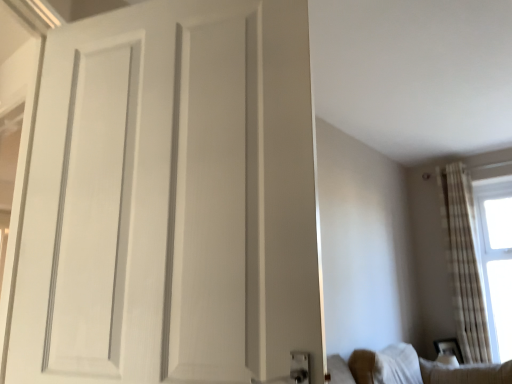
Locate an element on the screen. The width and height of the screenshot is (512, 384). white matte door at center is located at coordinates (173, 199).

This screenshot has height=384, width=512. Describe the element at coordinates (496, 258) in the screenshot. I see `white sheer curtain at right` at that location.

The image size is (512, 384). Describe the element at coordinates (464, 262) in the screenshot. I see `white sheer curtains at right` at that location.

Describe the element at coordinates (414, 370) in the screenshot. This screenshot has height=384, width=512. I see `white fabric couch at lower right` at that location.

Image resolution: width=512 pixels, height=384 pixels. Identify the location of white matte door at center. (173, 199).

Would you say white sheer curtains at right is outside white matte door at center?

That's correct, white sheer curtains at right is outside of white matte door at center.

Is white sheer curtains at right to the left of white matte door at center from the viewer's perspective?

No, white sheer curtains at right is not to the left of white matte door at center.

Considering the sizes of objects white sheer curtains at right and white matte door at center in the image provided, who is smaller, white sheer curtains at right or white matte door at center?

white matte door at center is smaller.

This screenshot has height=384, width=512. I want to click on window behind the white matte door at center, so click(x=464, y=262).

Between point (376, 356) and point (504, 330), which one is positioned behind?

The point (504, 330) is behind.

Does white fabric couch at lower right have a smaller size compared to white sheer curtain at right?

Yes.

Is white fabric couch at lower right not close to white sheer curtain at right?

Absolutely, white fabric couch at lower right is distant from white sheer curtain at right.

Could you tell me if white fabric couch at lower right is turned towards white sheer curtain at right?

No.

In terms of width, does white sheer curtain at right look wider or thinner when compared to white fabric couch at lower right?

In the image, white sheer curtain at right appears to be more narrow than white fabric couch at lower right.

From a real-world perspective, is white sheer curtain at right positioned above or below white fabric couch at lower right?

white sheer curtain at right is situated higher than white fabric couch at lower right in the real world.

Looking at this image, which point is more distant from viewer, (488, 285) or (417, 362)?

Positioned behind is point (488, 285).

Is white sheer curtain at right bigger or smaller than white fabric couch at lower right?

Clearly, white sheer curtain at right is larger in size than white fabric couch at lower right.

Image resolution: width=512 pixels, height=384 pixels. What are the coordinates of `window screen on the right of white sheer curtains at right` in the screenshot? It's located at (496, 258).

Which is in front, white sheer curtain at right or white sheer curtains at right?

Positioned in front is white sheer curtains at right.

From the image's perspective, does white sheer curtain at right appear higher than white sheer curtains at right?

No, from the image's perspective, white sheer curtain at right is not on top of white sheer curtains at right.

In the scene shown: Is white sheer curtains at right positioned far away from white fabric couch at lower right?

Indeed, white sheer curtains at right is not near white fabric couch at lower right.

Locate an element on the screen. Image resolution: width=512 pixels, height=384 pixels. window lying behind the white fabric couch at lower right is located at coordinates [464, 262].

From a real-world perspective, which object rests below the other?

white fabric couch at lower right, from a real-world perspective.

Between white sheer curtains at right and white fabric couch at lower right, which one has smaller width?

white fabric couch at lower right.

Which is behind, point (58, 372) or point (481, 361)?

The point (481, 361) is farther.

Based on their sizes in the image, would you say white matte door at center is bigger or smaller than white sheer curtains at right?

In the image, white matte door at center appears to be smaller than white sheer curtains at right.

Based on the photo, from the image's perspective, is white matte door at center over white sheer curtains at right?

Yes, from the image's perspective, white matte door at center is over white sheer curtains at right.

Who is more distant, white fabric couch at lower right or white sheer curtains at right?

white sheer curtains at right is behind.

Consider the image. Can you tell me how much white fabric couch at lower right and white sheer curtains at right differ in facing direction?

white fabric couch at lower right and white sheer curtains at right are facing 9.03 degrees away from each other.

Is white fabric couch at lower right not within white sheer curtains at right?

Yes, white fabric couch at lower right is not within white sheer curtains at right.

This screenshot has height=384, width=512. What are the coordinates of `door located on the left of white sheer curtains at right` in the screenshot? It's located at (173, 199).

Identify the location of furniture below the white sheer curtain at right (from a real-world perspective). The image size is (512, 384). (414, 370).

Which object lies nearer to the anchor point white fabric couch at lower right, white sheer curtains at right or white sheer curtain at right?

The object closer to white fabric couch at lower right is white sheer curtains at right.

Consider the image. Considering their positions, is white fabric couch at lower right positioned further to white sheer curtain at right than white matte door at center?

Among the two, white matte door at center is located further to white sheer curtain at right.

Looking at the image, which one is located closer to white sheer curtain at right, white matte door at center or white fabric couch at lower right?

The object closer to white sheer curtain at right is white fabric couch at lower right.

Estimate the real-world distances between objects in this image. Which object is further from white sheer curtain at right, white sheer curtains at right or white matte door at center?

white matte door at center lies further to white sheer curtain at right than the other object.

Considering their positions, is white sheer curtains at right positioned closer to white matte door at center than white sheer curtain at right?

white sheer curtains at right.

Consider the image. Considering their positions, is white fabric couch at lower right positioned closer to white matte door at center than white sheer curtain at right?

white fabric couch at lower right.

Consider the image. Considering their positions, is white sheer curtain at right positioned closer to white matte door at center than white sheer curtains at right?

white sheer curtains at right lies closer to white matte door at center than the other object.

When comparing their distances from white sheer curtain at right, does white sheer curtains at right or white fabric couch at lower right seem closer?

The object closer to white sheer curtain at right is white sheer curtains at right.

Where is `window located between white matte door at center and white sheer curtain at right in the depth direction`? window located between white matte door at center and white sheer curtain at right in the depth direction is located at coordinates (464, 262).

Find the location of a particular element. The width and height of the screenshot is (512, 384). furniture between white matte door at center and white sheer curtains at right in the front-back direction is located at coordinates (414, 370).

In order to click on window between white fabric couch at lower right and white sheer curtain at right along the z-axis in this screenshot , I will do `click(464, 262)`.

I want to click on furniture positioned between white matte door at center and white sheer curtain at right from near to far, so click(x=414, y=370).